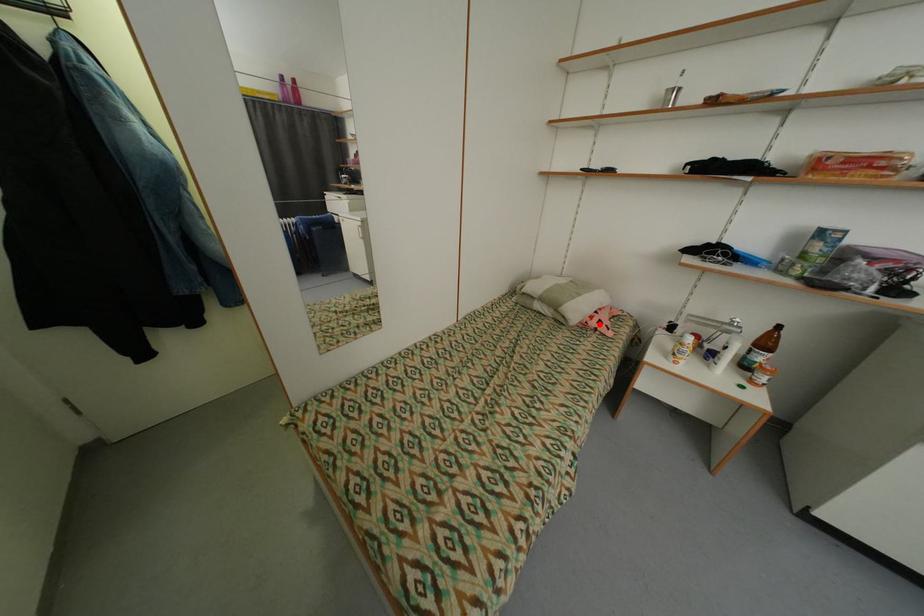
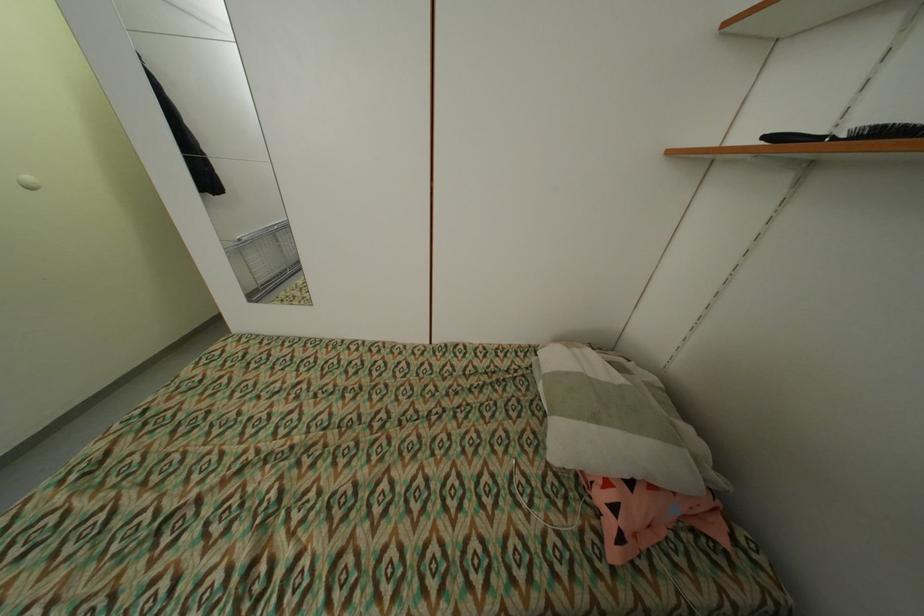
Where in the second image is the point corresponding to the highlighted location from the first image?

(606, 498)